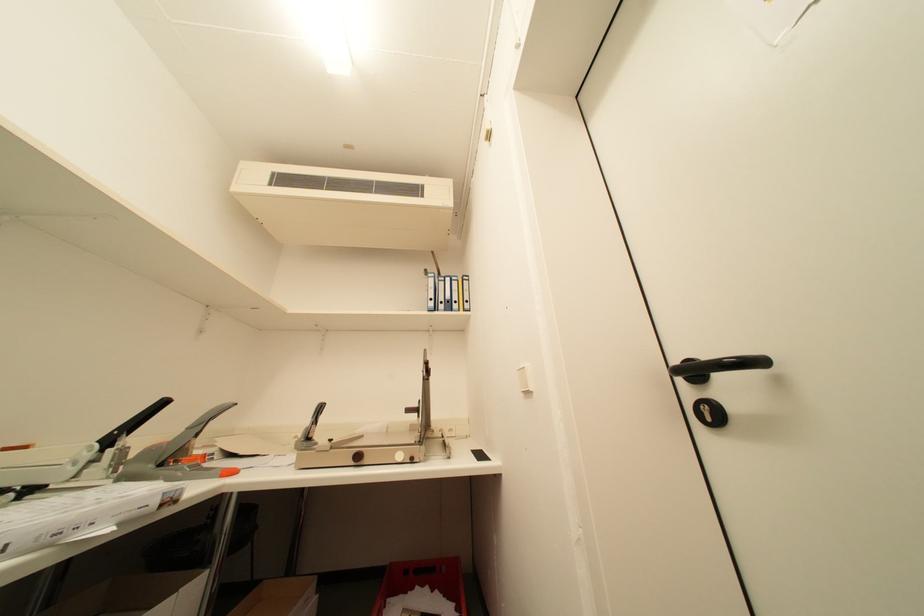
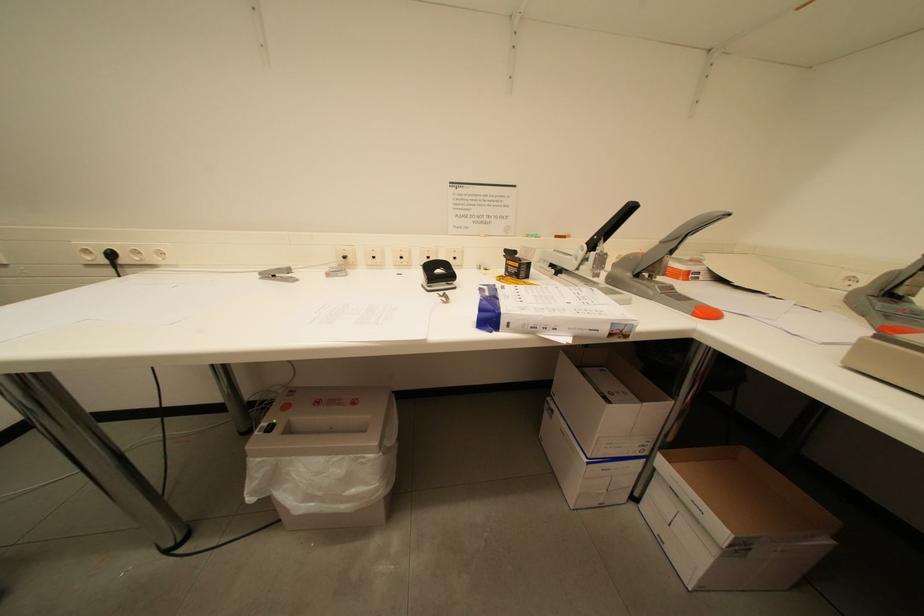
Consider the image. Based on the continuous images, in which direction is the camera rotating?

The camera rotated toward left-down.